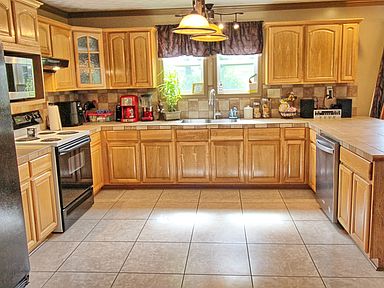
Locate an element on the screen. Image resolution: width=384 pixels, height=288 pixels. warming tray is located at coordinates (79, 207).